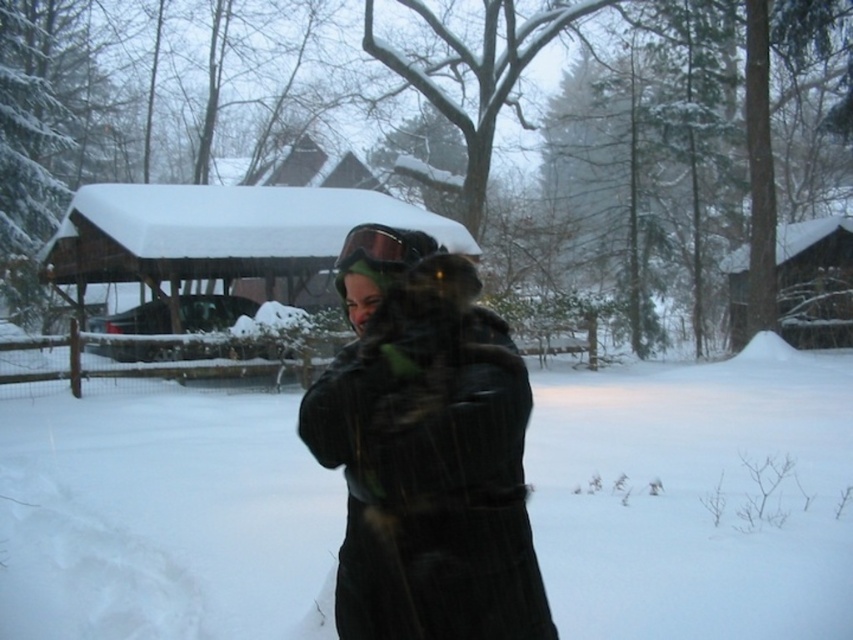
Can you confirm if white fluffy snow at center is positioned above wooden cabin at center?

No, white fluffy snow at center is not above wooden cabin at center.

Is white fluffy snow at center wider than wooden cabin at center?

Indeed, white fluffy snow at center has a greater width compared to wooden cabin at center.

Which is behind, point (321, 573) or point (294, 192)?

Point (294, 192)

You are a GUI agent. You are given a task and a screenshot of the screen. Output one action in this format:
    pyautogui.click(x=<x>, y=<y>)
    Task: Click on the white fluffy snow at center
    
    Given the screenshot: What is the action you would take?
    pyautogui.click(x=694, y=497)

Does point (244, 228) come farther from viewer compared to point (352, 260)?

That is True.

Which of these two, wooden cabin at center or green matte goggles at center, stands taller?

wooden cabin at center is taller.

Is point (213, 220) in front of point (393, 273)?

No, (213, 220) is further to viewer.

Where is `wooden cabin at center`? The image size is (853, 640). wooden cabin at center is located at coordinates (221, 232).

Between point (683, 618) and point (392, 237), which one is positioned behind?

Positioned behind is point (683, 618).

Which of these two, white fluffy snow at center or green matte goggles at center, stands shorter?

white fluffy snow at center

The height and width of the screenshot is (640, 853). What do you see at coordinates (694, 497) in the screenshot?
I see `white fluffy snow at center` at bounding box center [694, 497].

Locate an element on the screen. This screenshot has height=640, width=853. white fluffy snow at center is located at coordinates coord(694,497).